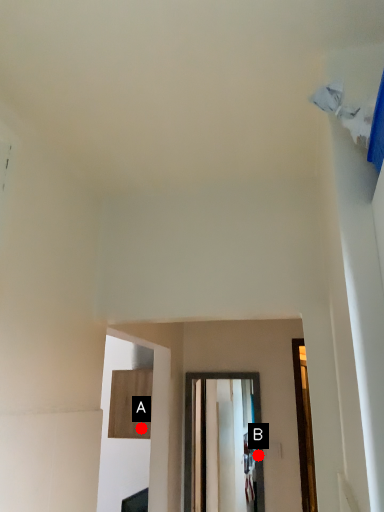
Question: Two points are circled on the image, labeled by A and B beside each circle. Which point is closer to the camera?

Choices:
 (A) A is closer
 (B) B is closer

Answer: (B)